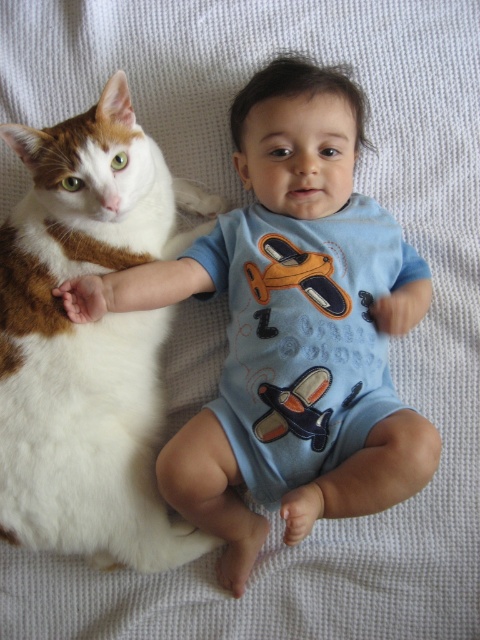
Which is behind, point (310, 252) or point (106, 308)?

The point (310, 252) is more distant.

Measure the distance between blue cotton onesie at center and white fur paw at left.

blue cotton onesie at center and white fur paw at left are 12.60 inches apart.

What do you see at coordinates (296, 330) in the screenshot? I see `blue cotton onesie at center` at bounding box center [296, 330].

This screenshot has height=640, width=480. Find the location of `blue cotton onesie at center`. blue cotton onesie at center is located at coordinates (296, 330).

Is white fluffy cat at left shorter than white fur paw at left?

No, white fluffy cat at left is not shorter than white fur paw at left.

Can you confirm if white fluffy cat at left is bigger than white fur paw at left?

Yes, white fluffy cat at left is bigger than white fur paw at left.

Between point (91, 531) and point (78, 305), which one is positioned in front?

Positioned in front is point (91, 531).

Identify the location of white fluffy cat at left. Image resolution: width=480 pixels, height=640 pixels. (87, 340).

Measure the distance between blue cotton onesie at center and white fluffy cat at left.

A distance of 6.51 inches exists between blue cotton onesie at center and white fluffy cat at left.

Is blue cotton onesie at center to the left of white fluffy cat at left from the viewer's perspective?

Incorrect, blue cotton onesie at center is not on the left side of white fluffy cat at left.

You are a GUI agent. You are given a task and a screenshot of the screen. Output one action in this format:
    pyautogui.click(x=<x>, y=<y>)
    Task: Click on the blue cotton onesie at center
    
    Given the screenshot: What is the action you would take?
    pyautogui.click(x=296, y=330)

The width and height of the screenshot is (480, 640). I want to click on blue cotton onesie at center, so (296, 330).